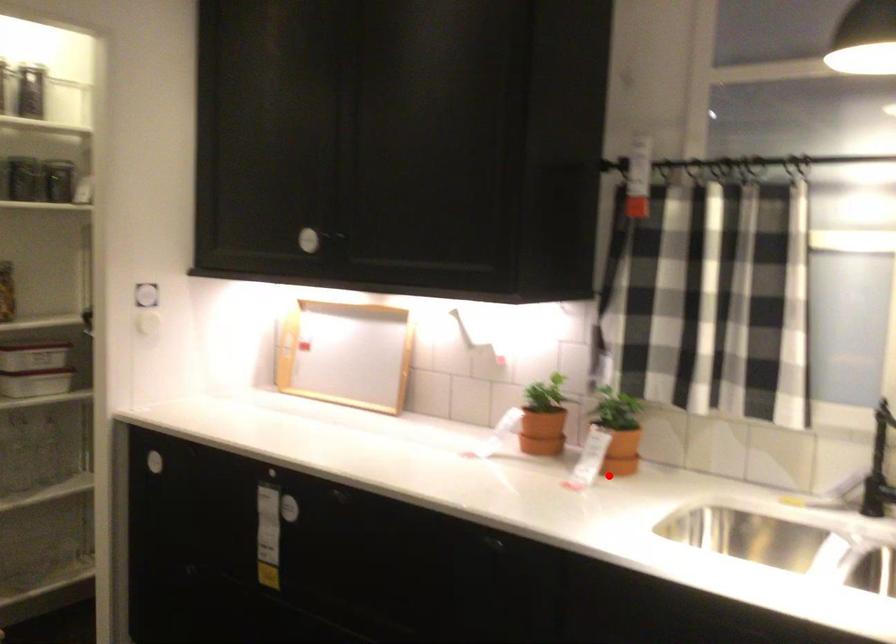
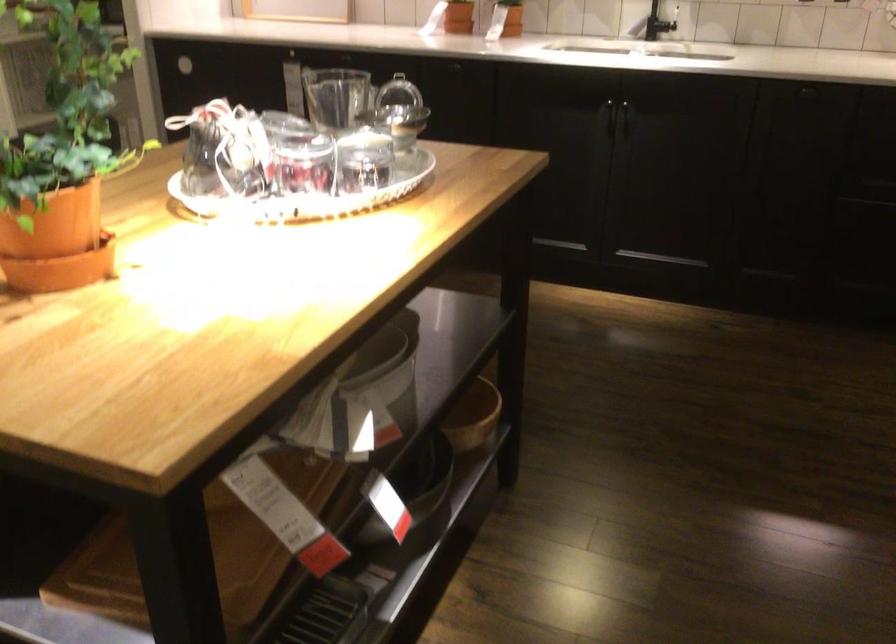
Question: I am providing you with two images of the same scene from different viewpoints. A red point is shown in image1. For the corresponding object point in image2, is it positioned nearer or farther from the camera?

Choices:
 (A) Nearer
 (B) Farther

Answer: (B)